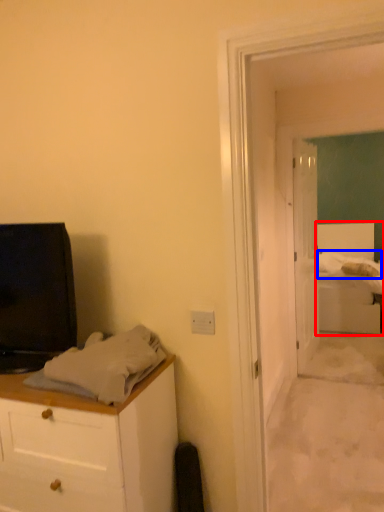
Question: Which of the following is the farthest to the observer, bed (highlighted by a red box) or sheet (highlighted by a blue box)?

Choices:
 (A) bed
 (B) sheet

Answer: (B)